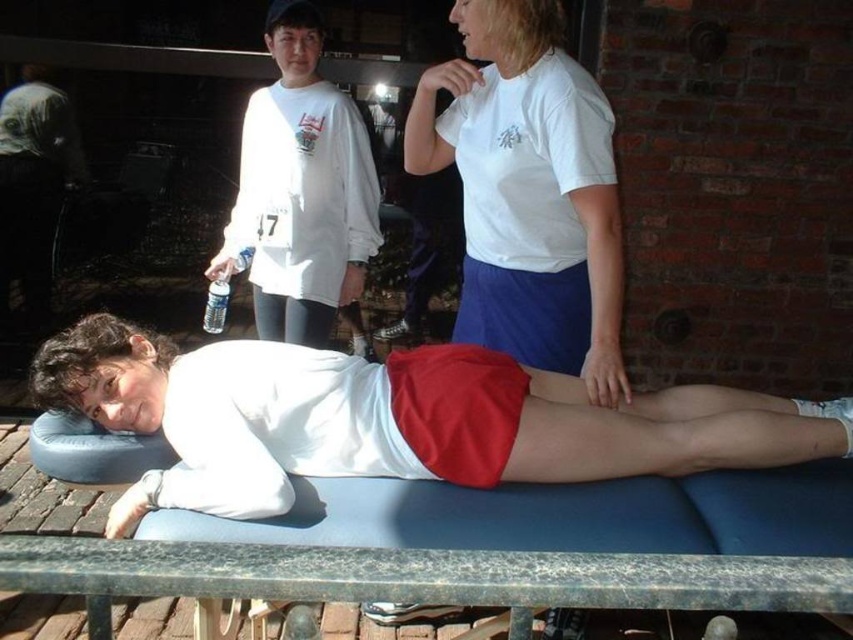
You are a photographer positioned at point 0.0, 0.0. You need to capture a photo of the white matte shirt at center. Which direction should you move to get a better shot?

The white matte shirt at center is located at point [393,419]. Since you are at [0,0], you should move towards the northeast direction to align with the shirt.

You are standing at the point labeled as point (628, 579). You want to take a photo of the entire massage table scene. The camera you have is 26.49 inches away from you. Can you take the photo without moving your position?

Yes, because the camera is exactly 26.49 inches away from point (628, 579), which is your current position, so you can take the photo without moving.